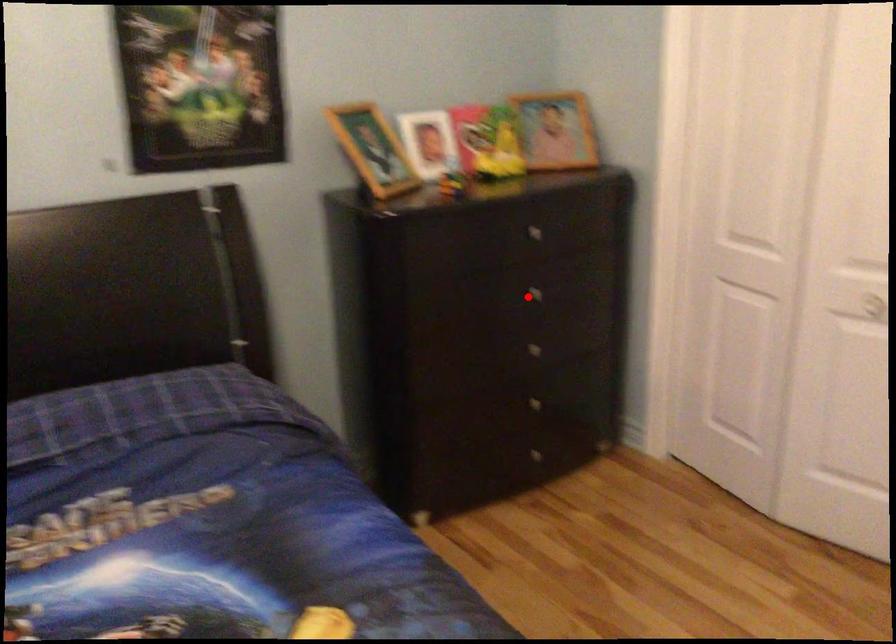
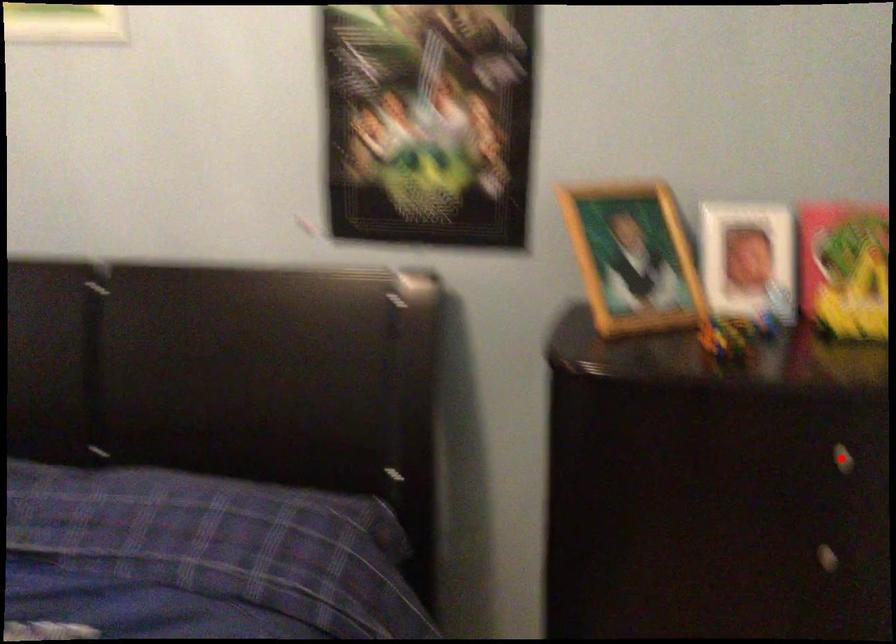
I am providing you with two images of the same scene from different viewpoints. A red point is marked on the first image and another point is marked on the second image. Are the points marked in image1 and image2 representing the same 3D position?

No